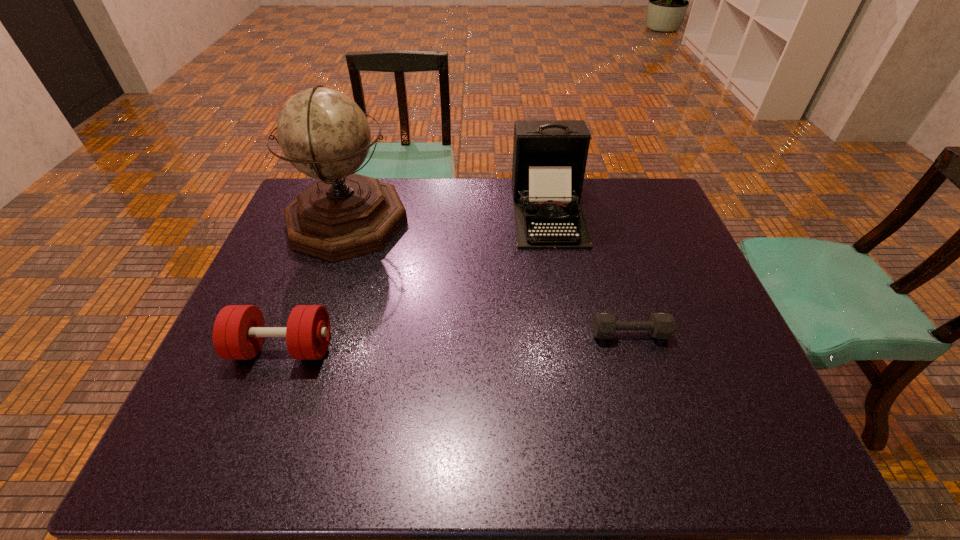
Locate an element on the screen. Image resolution: width=960 pixels, height=540 pixels. object that stands as the closest to the globe is located at coordinates (238, 333).

Select which object is the closest to the shorter dumbbell. Please provide its 2D coordinates. Your answer should be formatted as a tuple, i.e. [(x, y)], where the tuple contains the x and y coordinates of a point satisfying the conditions above.

[(549, 156)]

Locate an element on the screen. This screenshot has width=960, height=540. vacant space that satisfies the following two spatial constraints: 1. inside the open case of the shortest object; 2. on the right side of the typewriter is located at coordinates (570, 334).

Identify the location of vacant region that satisfies the following two spatial constraints: 1. on the surface of the tallest object; 2. on the right side of the shortest object. (309, 334).

I want to click on free point that satisfies the following two spatial constraints: 1. inside the open case of the third shortest object; 2. on the right side of the shorter dumbbell, so click(570, 334).

Where is `free space that satisfies the following two spatial constraints: 1. inside the open case of the typewriter; 2. on the left side of the right dumbbell`? Image resolution: width=960 pixels, height=540 pixels. free space that satisfies the following two spatial constraints: 1. inside the open case of the typewriter; 2. on the left side of the right dumbbell is located at coordinates (570, 334).